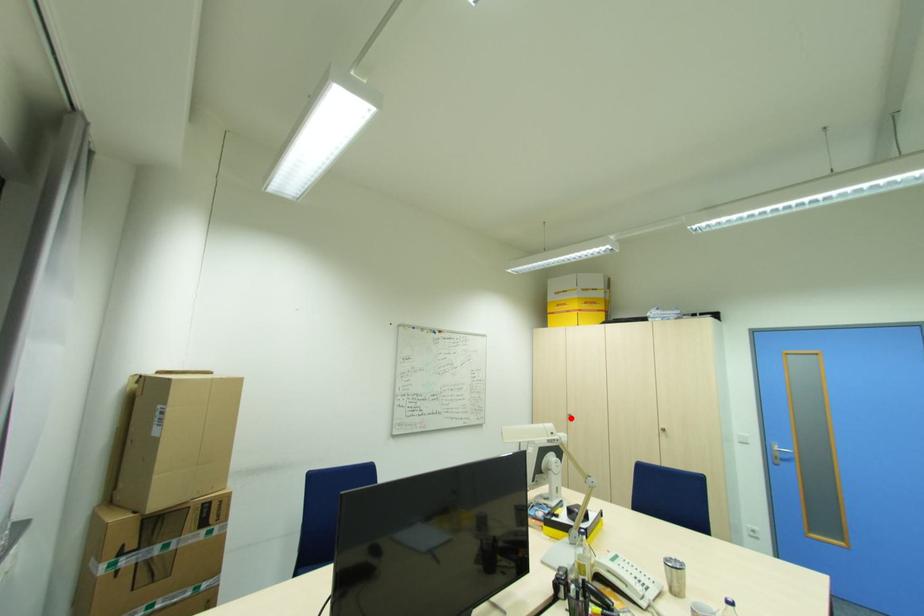
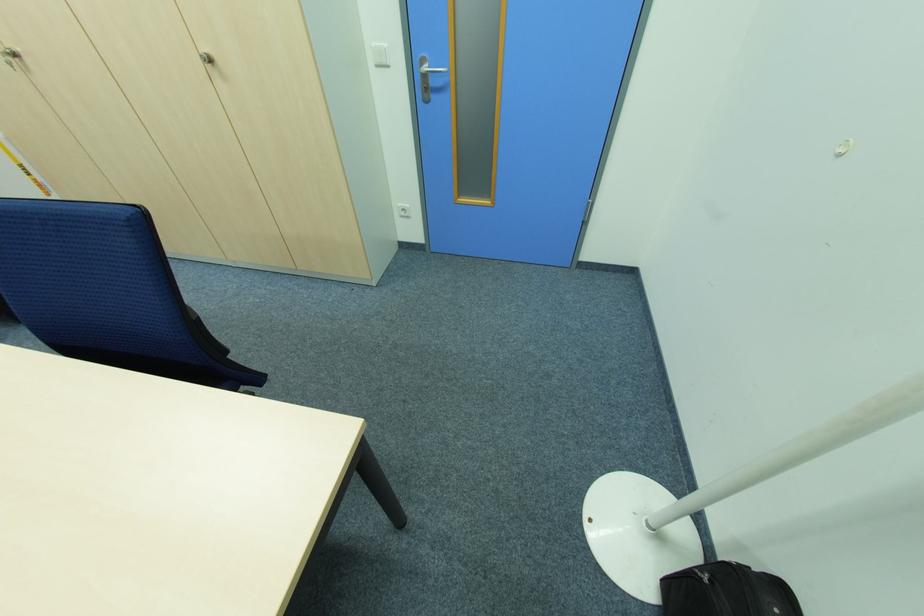
Where in the second image is the point corresponding to the highlighted location from the first image?

(14, 65)